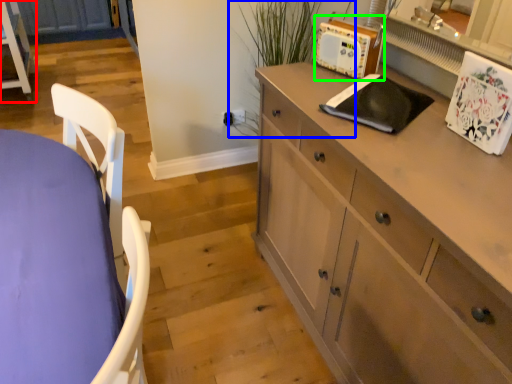
Question: Estimate the real-world distances between objects in this image. Which object is closer to chest of drawers (highlighted by a red box), plant (highlighted by a blue box) or appliance (highlighted by a green box)?

Choices:
 (A) plant
 (B) appliance

Answer: (A)